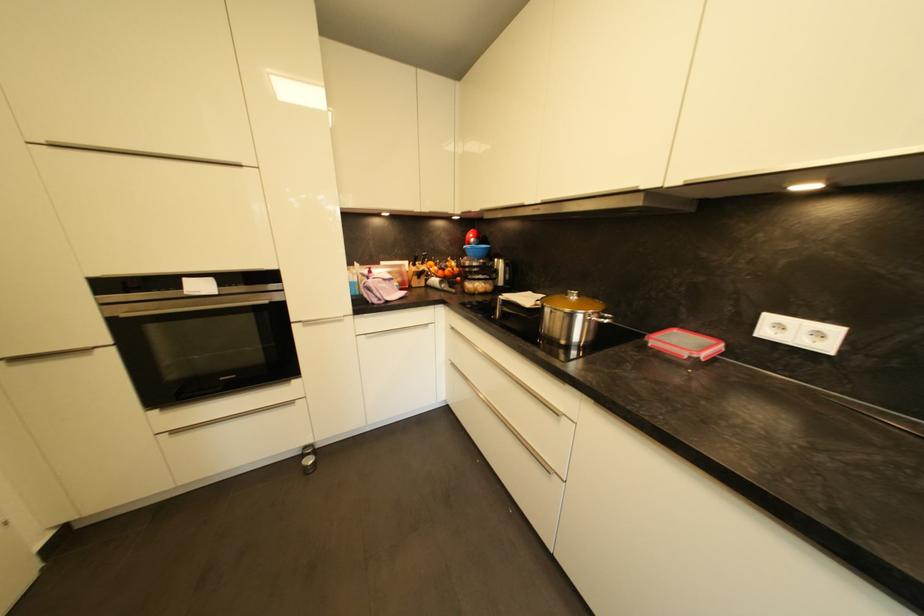
Where would you lift the pot side handle? Please return your answer as a coordinate pair (x, y).

(602, 318)